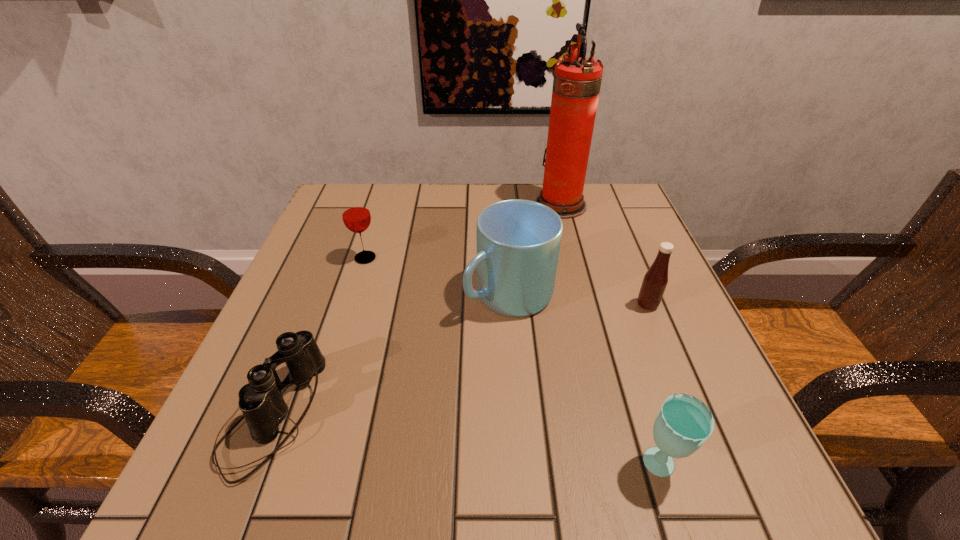
Locate an element on the screen. the farthest object is located at coordinates (576, 85).

Identify the location of fire extinguisher. (576, 85).

Where is `mug`? This screenshot has width=960, height=540. mug is located at coordinates (518, 241).

What are the coordinates of `the farther glass` in the screenshot? It's located at (356, 216).

Where is `the fifth nearest object`? The width and height of the screenshot is (960, 540). the fifth nearest object is located at coordinates (356, 216).

Identify the location of the rightmost object. Image resolution: width=960 pixels, height=540 pixels. (655, 280).

Where is `the right glass`? the right glass is located at coordinates (684, 423).

Where is `binoculars`? The height and width of the screenshot is (540, 960). binoculars is located at coordinates click(261, 402).

At what (x,y) coordinates should I click in order to perform the action: click on free location located at the discharge end of the fire extinguisher. Please return your answer as a coordinate pair (x, y). Looking at the image, I should click on (377, 205).

What are the coordinates of `vacant space located 0.380m at the discharge end of the fire extinguisher` in the screenshot? It's located at (385, 205).